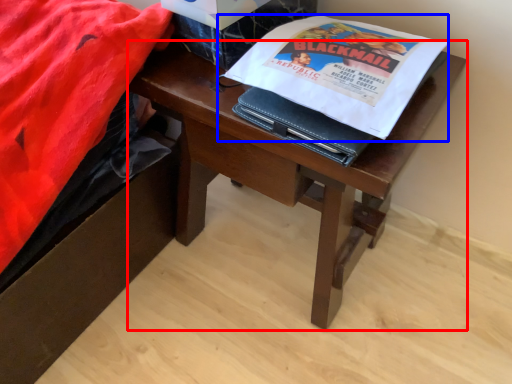
Question: Which object is further to the camera taking this photo, desk (highlighted by a red box) or paperback book (highlighted by a blue box)?

Choices:
 (A) desk
 (B) paperback book

Answer: (A)